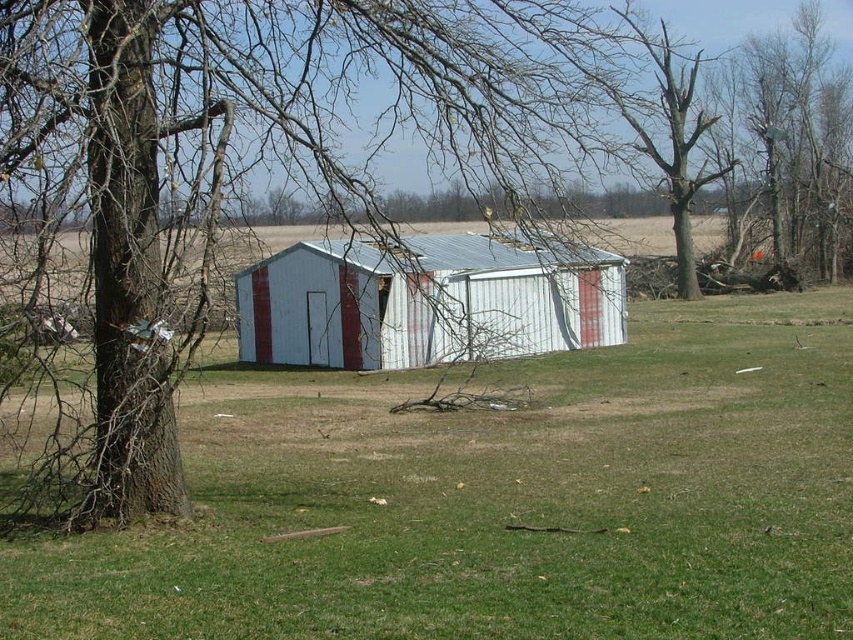
Can you confirm if brown bark tree at left is bigger than bare wood tree at upper right?

Correct, brown bark tree at left is larger in size than bare wood tree at upper right.

Between point (22, 65) and point (827, 128), which one is positioned behind?

The point (827, 128) is more distant.

At what (x,y) coordinates should I click in order to perform the action: click on brown bark tree at left. Please return your answer as a coordinate pair (x, y). Image resolution: width=853 pixels, height=640 pixels. Looking at the image, I should click on (294, 186).

Can you confirm if green grass at center is shorter than bare wood tree at upper right?

Yes.

Who is positioned more to the right, green grass at center or bare wood tree at upper right?

From the viewer's perspective, bare wood tree at upper right appears more on the right side.

Find the location of a particular element. green grass at center is located at coordinates (498, 499).

Does point (259, 337) come farther from viewer compared to point (770, 92)?

No, it is in front of (770, 92).

Who is more distant from viewer, (x=418, y=346) or (x=849, y=224)?

Positioned behind is point (x=849, y=224).

Who is more distant from viewer, (602, 252) or (850, 218)?

Point (850, 218)

This screenshot has height=640, width=853. I want to click on white corrugated metal shed at center, so [426, 301].